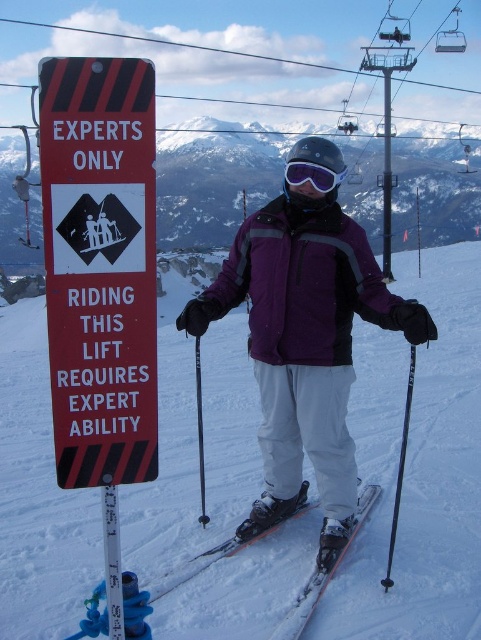
You are a ski equipment inspector checking the gear of a skier. You notice the shiny metallic ski at center and the purple matte ski goggles at center. Which item is shorter in height?

The shiny metallic ski at center is not as tall as the purple matte ski goggles at center, so the shiny metallic ski at center is shorter in height.

You are a photographer trying to capture the skier from above. You notice the shiny metallic ski at center and the purple matte ski goggles at center. Which object is positioned lower from your viewpoint?

The shiny metallic ski at center is below the purple matte ski goggles at center, so the shiny metallic ski at center is positioned lower from your viewpoint.